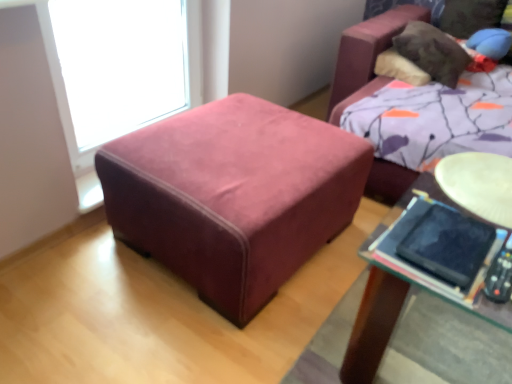
Question: Is velvet ottoman at center facing away from transparent glass window at upper left?

Choices:
 (A) no
 (B) yes

Answer: (B)

Question: Considering the relative sizes of velvet ottoman at center and transparent glass window at upper left in the image provided, is velvet ottoman at center shorter than transparent glass window at upper left?

Choices:
 (A) yes
 (B) no

Answer: (A)

Question: Is transparent glass window at upper left a part of velvet ottoman at center?

Choices:
 (A) no
 (B) yes

Answer: (A)

Question: Could you tell me if velvet ottoman at center is facing transparent glass window at upper left?

Choices:
 (A) yes
 (B) no

Answer: (B)

Question: From the image's perspective, would you say velvet ottoman at center is positioned over transparent glass window at upper left?

Choices:
 (A) no
 (B) yes

Answer: (A)

Question: Does velvet ottoman at center have a smaller size compared to transparent glass window at upper left?

Choices:
 (A) yes
 (B) no

Answer: (B)

Question: Is transparent glass window at upper left to the left of velvet ottoman at center from the viewer's perspective?

Choices:
 (A) no
 (B) yes

Answer: (B)

Question: From the image's perspective, is transparent glass window at upper left over velvet ottoman at center?

Choices:
 (A) no
 (B) yes

Answer: (B)

Question: Is transparent glass window at upper left positioned far away from velvet ottoman at center?

Choices:
 (A) yes
 (B) no

Answer: (B)

Question: Can you confirm if transparent glass window at upper left is shorter than velvet ottoman at center?

Choices:
 (A) yes
 (B) no

Answer: (B)

Question: Is transparent glass window at upper left oriented away from velvet ottoman at center?

Choices:
 (A) yes
 (B) no

Answer: (B)

Question: Can we say transparent glass window at upper left lies outside velvet ottoman at center?

Choices:
 (A) no
 (B) yes

Answer: (B)

Question: Does transparent glass window at upper left have a smaller size compared to black matte tablet at lower right?

Choices:
 (A) no
 (B) yes

Answer: (A)